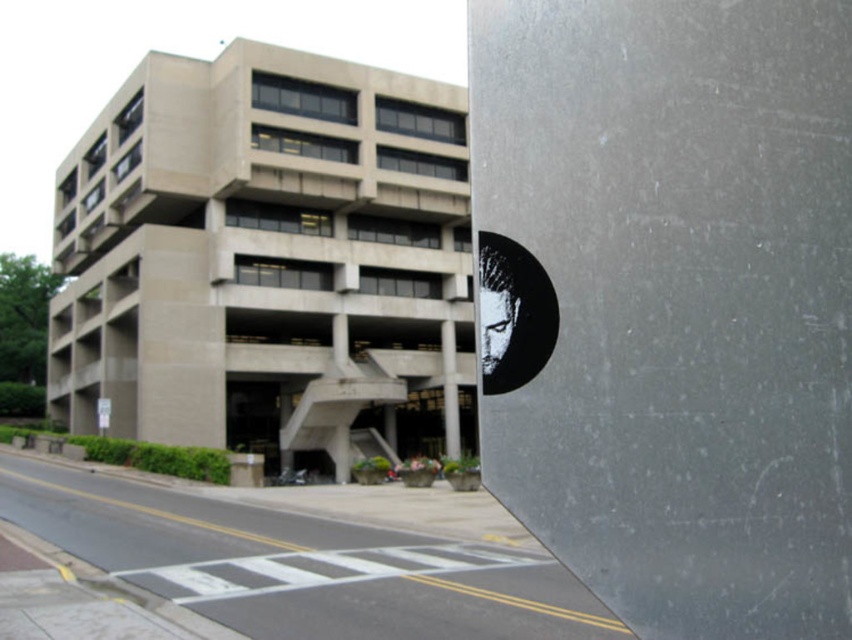
You are standing in front of the modern building and notice the black glossy sticker at upper right and the smooth concrete pole at center. Which object is closer to you?

The black glossy sticker at upper right is closer because it is in front of the smooth concrete pole at center.

You are a maintenance worker needing to reach both the smooth concrete pole at center and the white plastic sign at lower left. Which object should you attend to first based on their proximity to you?

You should attend to the smooth concrete pole at center first because it is closer to you than the white plastic sign at lower left.